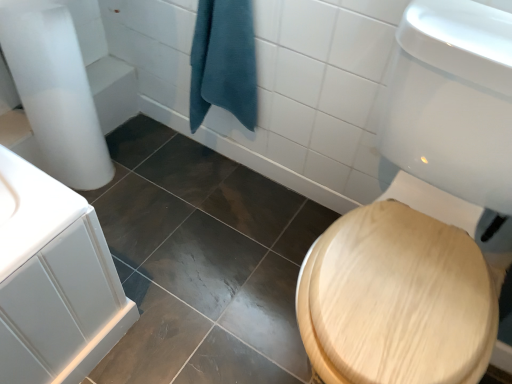
Question: Considering the positions of teal cotton towel at center and wooden at right in the image, is teal cotton towel at center bigger or smaller than wooden at right?

Choices:
 (A) big
 (B) small

Answer: (B)

Question: Is teal cotton towel at center wider or thinner than wooden at right?

Choices:
 (A) wide
 (B) thin

Answer: (B)

Question: Does point (194, 82) appear closer or farther from the camera than point (492, 334)?

Choices:
 (A) farther
 (B) closer

Answer: (A)

Question: Do you think wooden at right is within teal cotton towel at center, or outside of it?

Choices:
 (A) inside
 (B) outside

Answer: (B)

Question: Is wooden at right taller or shorter than teal cotton towel at center?

Choices:
 (A) tall
 (B) short

Answer: (A)

Question: Looking at their shapes, would you say wooden at right is wider or thinner than teal cotton towel at center?

Choices:
 (A) wide
 (B) thin

Answer: (A)

Question: From a real-world perspective, relative to teal cotton towel at center, is wooden at right vertically above or below?

Choices:
 (A) above
 (B) below

Answer: (B)